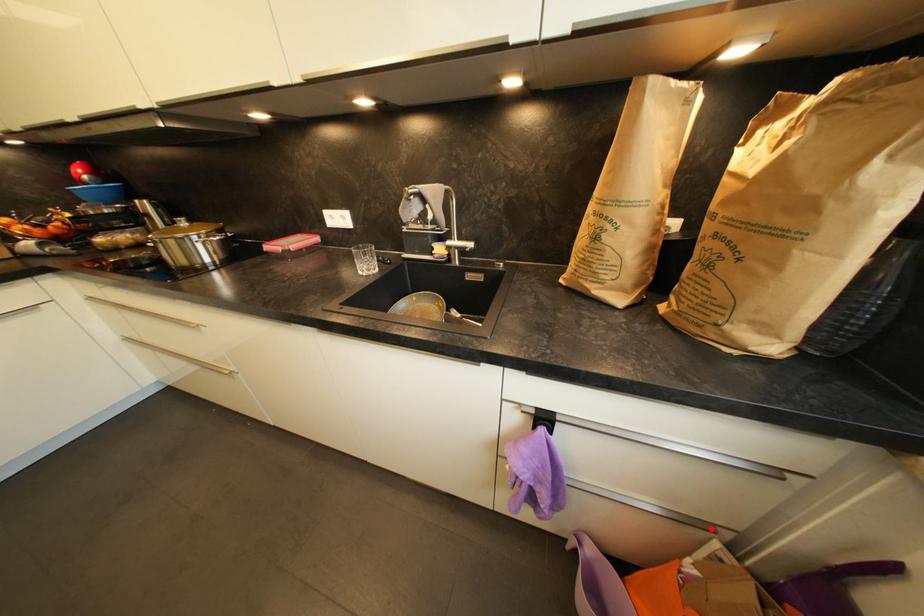
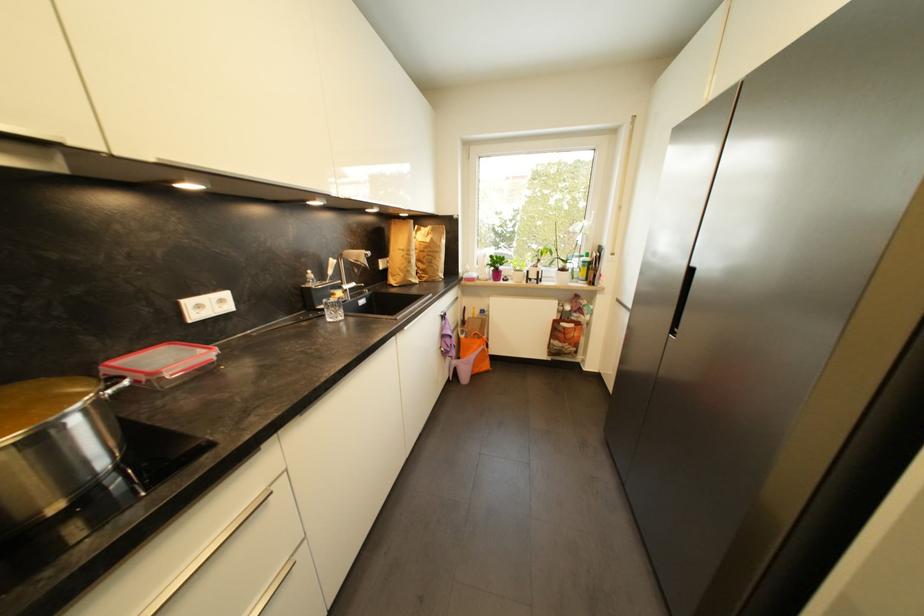
Where in the second image is the point corresponding to the highlighted location from the first image?

(463, 328)